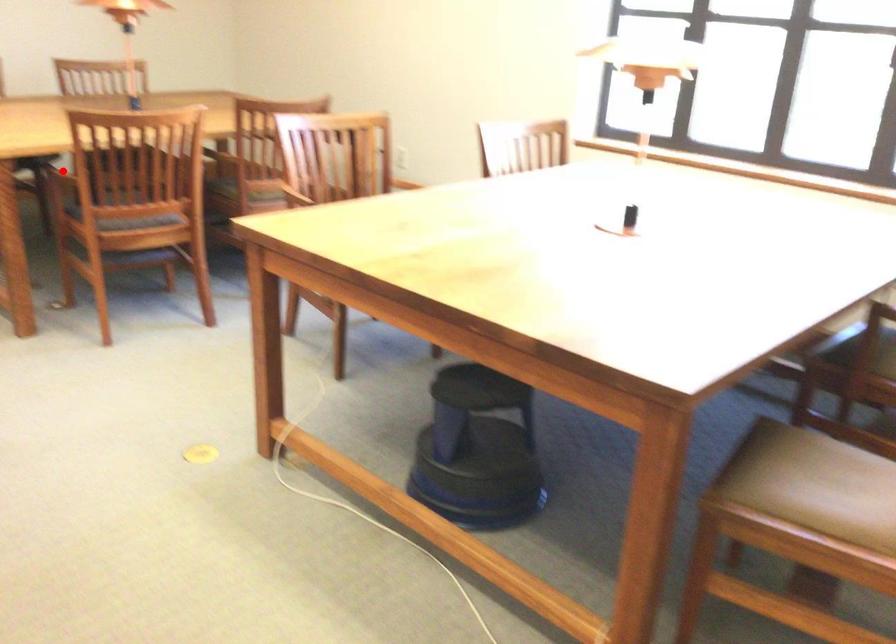
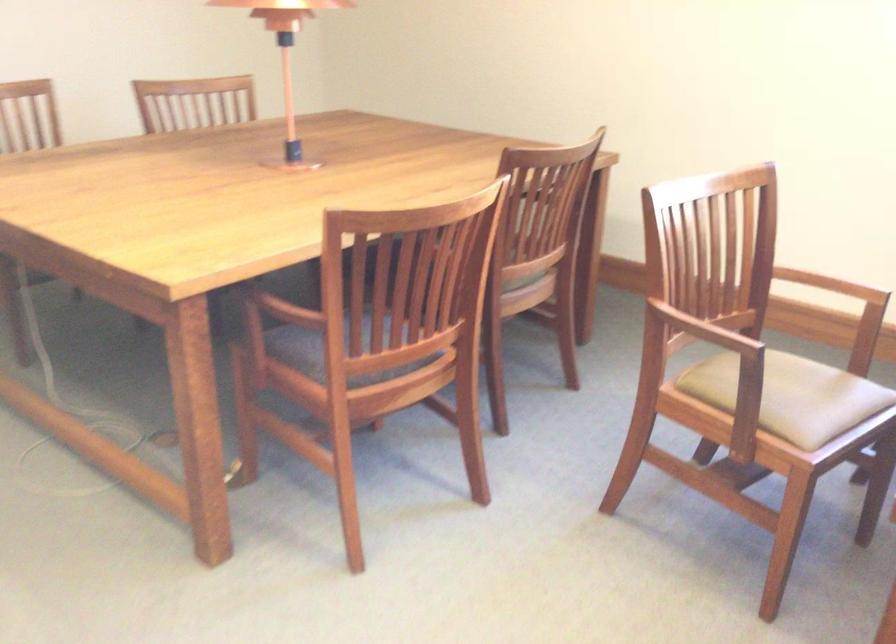
Question: I am providing you with two images of the same scene from different viewpoints. A red point is marked on the first image. Can you still see the location of the red point in image 2?

Choices:
 (A) Yes
 (B) No

Answer: (B)